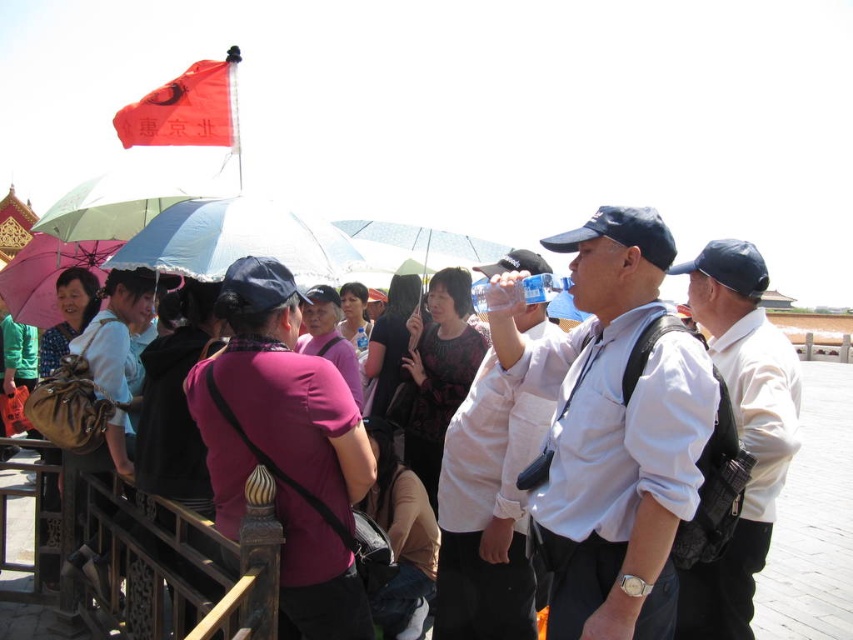
You are a photographer trying to capture a photo of the white matte shirt at center and the brown wood railing at lower left. Which object should you focus on first if you want to ensure both are in focus without adjusting your camera settings?

The white matte shirt at center is much taller than the brown wood railing at lower left, so focusing on the white matte shirt at center first would help ensure both are in focus since it is closer to the camera.

You are a photographer standing at the center of the scene. You want to take a photo of the white matte shirt at center. Where should you aim your camera?

The white matte shirt at center is located at point 0.800 on the x axis and 0.572 on the y axis, so you should aim your camera at those coordinates to capture it.

You are standing in the group of people at the historical site and want to take a photo of two specific points marked in the scene. The first point is at coordinates point (259, 244) and the second is at point (395, 349). Which point should you focus on first if you want to capture both in a single frame without moving your camera?

You should focus on point (259, 244) first because it is closer to the viewer than point (395, 349). By starting with the closer point, you can adjust your camera angle to include both points in the frame without moving.